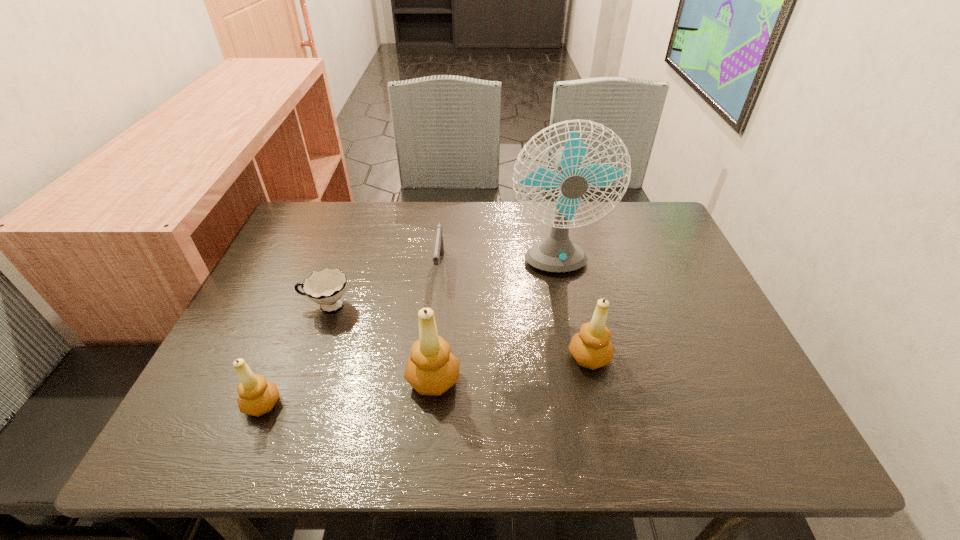
The height and width of the screenshot is (540, 960). Identify the location of the leftmost candle_holder. (257, 396).

I want to click on the fourth tallest object, so click(257, 396).

This screenshot has width=960, height=540. Identify the location of the second tallest object. (431, 369).

In order to click on the tallest candle_holder in this screenshot , I will do `click(431, 369)`.

You are a GUI agent. You are given a task and a screenshot of the screen. Output one action in this format:
    pyautogui.click(x=<x>, y=<y>)
    Task: Click on the second shortest candle_holder
    This screenshot has width=960, height=540.
    Given the screenshot: What is the action you would take?
    pyautogui.click(x=591, y=348)

The height and width of the screenshot is (540, 960). I want to click on the rightmost candle_holder, so click(x=591, y=348).

The height and width of the screenshot is (540, 960). What are the coordinates of `the fourth nearest object` in the screenshot? It's located at (326, 287).

Find the location of a particular element. This screenshot has width=960, height=540. cup is located at coordinates (326, 287).

I want to click on fan, so click(557, 253).

This screenshot has height=540, width=960. What are the coordinates of `pistol` in the screenshot? It's located at (438, 253).